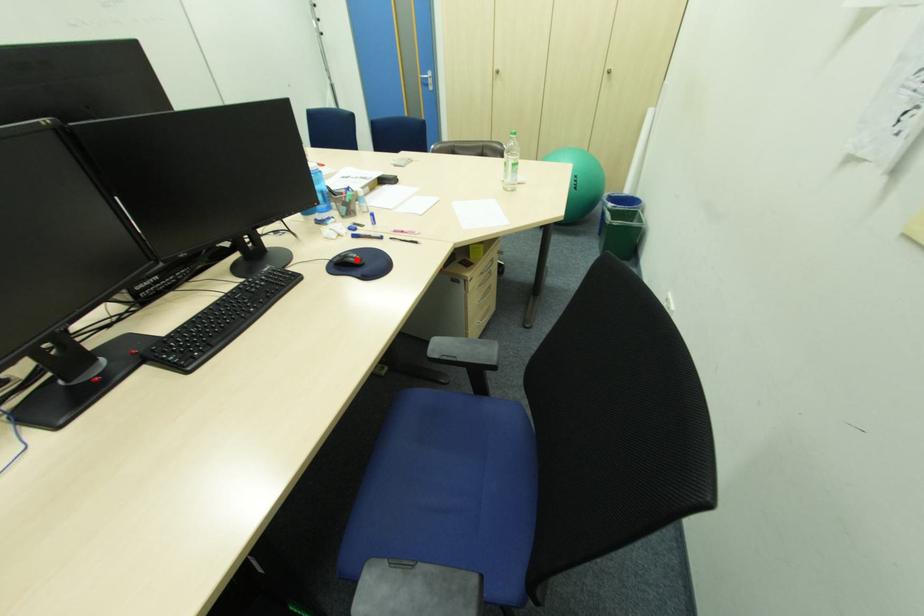
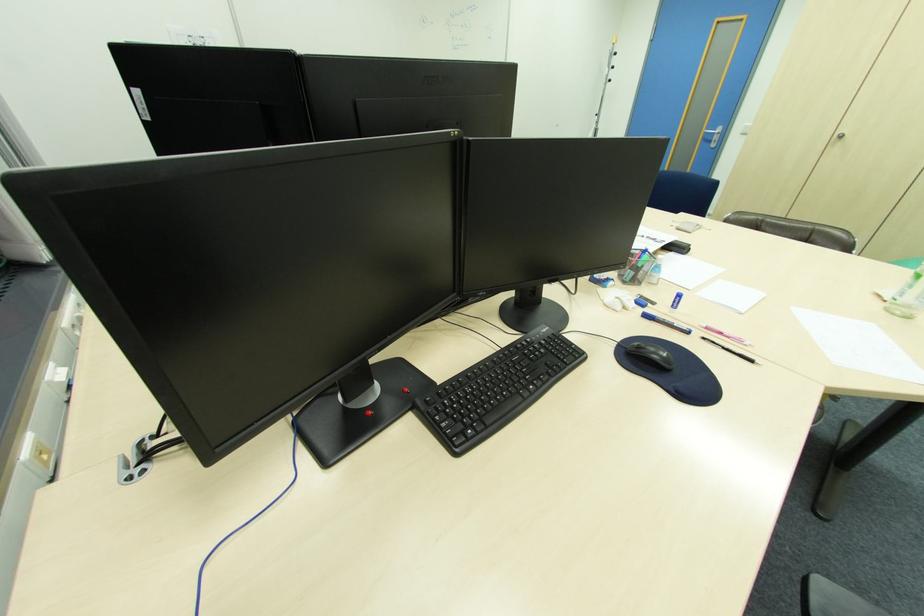
The point at the highlighted location is marked in the first image. Where is the corresponding point in the second image?

(662, 358)